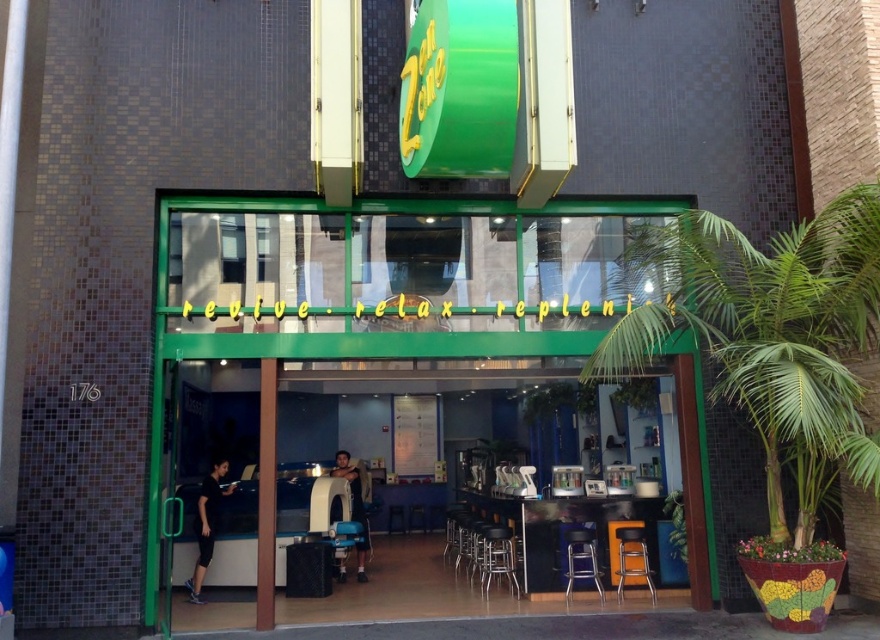
Is the position of metallic silver bar stool at center less distant than that of metallic silver chair at center?

No, metallic silver bar stool at center is further to the viewer.

Can you confirm if metallic silver bar stool at center is positioned to the left of metallic silver chair at center?

Yes, metallic silver bar stool at center is to the left of metallic silver chair at center.

Does point (482, 557) come in front of point (578, 532)?

No, it is not.

You are a GUI agent. You are given a task and a screenshot of the screen. Output one action in this format:
    pyautogui.click(x=<x>, y=<y>)
    Task: Click on the metallic silver bar stool at center
    The image size is (880, 640).
    Given the screenshot: What is the action you would take?
    pyautogui.click(x=497, y=557)

Is metallic gold bar stool at lower center to the right of metallic silver chair at center from the viewer's perspective?

Yes, metallic gold bar stool at lower center is to the right of metallic silver chair at center.

Which is more to the right, metallic gold bar stool at lower center or metallic silver chair at center?

metallic gold bar stool at lower center is more to the right.

At what (x,y) coordinates should I click in order to perform the action: click on metallic gold bar stool at lower center. Please return your answer as a coordinate pair (x, y). The height and width of the screenshot is (640, 880). Looking at the image, I should click on (632, 560).

Who is higher up, metallic gold bar stool at lower center or metallic silver bar stool at center?

metallic gold bar stool at lower center is above.

Is metallic gold bar stool at lower center taller than metallic silver bar stool at center?

Incorrect, metallic gold bar stool at lower center's height is not larger of metallic silver bar stool at center's.

Which is behind, point (614, 531) or point (504, 561)?

The point (504, 561) is behind.

The image size is (880, 640). I want to click on metallic gold bar stool at lower center, so click(x=632, y=560).